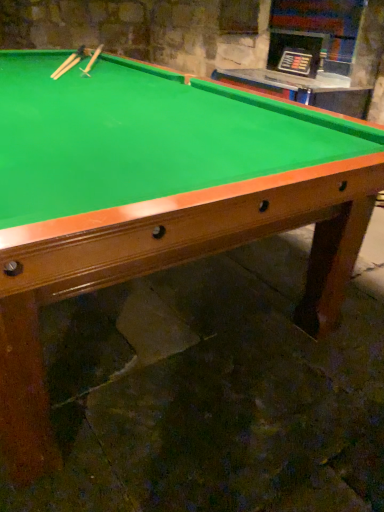
Question: Is wooden cue at upper left, placed as the first cue when sorted from right to left, facing away from wooden cue at upper left, which is the first cue in left-to-right order?

Choices:
 (A) no
 (B) yes

Answer: (A)

Question: Is wooden cue at upper left, placed as the first cue when sorted from right to left, shorter than wooden cue at upper left, the second cue positioned from the right?

Choices:
 (A) yes
 (B) no

Answer: (B)

Question: From a real-world perspective, is wooden cue at upper left, which is the second cue from left to right, beneath wooden cue at upper left, which is the first cue in left-to-right order?

Choices:
 (A) no
 (B) yes

Answer: (A)

Question: Is wooden cue at upper left, which is the second cue from left to right, taller than wooden cue at upper left, which is the first cue in left-to-right order?

Choices:
 (A) yes
 (B) no

Answer: (A)

Question: Does wooden cue at upper left, which is the second cue from left to right, appear on the left side of wooden cue at upper left, the second cue positioned from the right?

Choices:
 (A) yes
 (B) no

Answer: (B)

Question: Is wooden cue at upper left, placed as the first cue when sorted from right to left, placed right next to wooden cue at upper left, the second cue positioned from the right?

Choices:
 (A) no
 (B) yes

Answer: (A)

Question: Is wooden cue at upper left, which is the first cue in left-to-right order, at the left side of wooden cue at upper left, placed as the first cue when sorted from right to left?

Choices:
 (A) no
 (B) yes

Answer: (B)

Question: Does wooden cue at upper left, which is the first cue in left-to-right order, have a larger size compared to wooden cue at upper left, placed as the first cue when sorted from right to left?

Choices:
 (A) no
 (B) yes

Answer: (A)

Question: Does wooden cue at upper left, the second cue positioned from the right, appear on the right side of wooden cue at upper left, placed as the first cue when sorted from right to left?

Choices:
 (A) no
 (B) yes

Answer: (A)

Question: Can we say wooden cue at upper left, the second cue positioned from the right, lies outside wooden cue at upper left, which is the second cue from left to right?

Choices:
 (A) no
 (B) yes

Answer: (B)

Question: From a real-world perspective, is wooden cue at upper left, which is the first cue in left-to-right order, located higher than wooden cue at upper left, which is the second cue from left to right?

Choices:
 (A) no
 (B) yes

Answer: (A)

Question: Could you tell me if wooden cue at upper left, the second cue positioned from the right, is facing wooden cue at upper left, placed as the first cue when sorted from right to left?

Choices:
 (A) yes
 (B) no

Answer: (B)

Question: From the image's perspective, is wooden cue at upper left, placed as the first cue when sorted from right to left, positioned above or below wooden cue at upper left, which is the first cue in left-to-right order?

Choices:
 (A) below
 (B) above

Answer: (B)